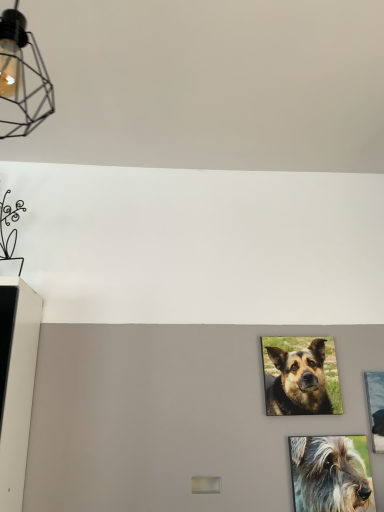
Question: Does brown fur dog at center, which is counted as the 1th dog, starting from the back, have a greater height compared to metallic silver picture frame at right?

Choices:
 (A) yes
 (B) no

Answer: (B)

Question: Is brown fur dog at center, which is the second dog from front to back, not within metallic silver picture frame at right?

Choices:
 (A) yes
 (B) no

Answer: (A)

Question: Is brown fur dog at center, the 2th dog when ordered from bottom to top, turned away from metallic silver picture frame at right?

Choices:
 (A) no
 (B) yes

Answer: (A)

Question: Considering the relative sizes of brown fur dog at center, which is the second dog from front to back, and metallic silver picture frame at right in the image provided, is brown fur dog at center, which is the second dog from front to back, smaller than metallic silver picture frame at right?

Choices:
 (A) no
 (B) yes

Answer: (B)

Question: Is brown fur dog at center, the 2th dog when ordered from bottom to top, bigger than metallic silver picture frame at right?

Choices:
 (A) no
 (B) yes

Answer: (A)

Question: From the image's perspective, is matte black wireframe light fixture at upper left positioned above or below brown fur dog at center, which is counted as the 1th dog, starting from the back?

Choices:
 (A) below
 (B) above

Answer: (B)

Question: Considering the positions of matte black wireframe light fixture at upper left and brown fur dog at center, which is counted as the 1th dog, starting from the back, in the image, is matte black wireframe light fixture at upper left wider or thinner than brown fur dog at center, which is counted as the 1th dog, starting from the back,?

Choices:
 (A) wide
 (B) thin

Answer: (A)

Question: Choose the correct answer: Is matte black wireframe light fixture at upper left inside brown fur dog at center, which is counted as the 1th dog, starting from the top, or outside it?

Choices:
 (A) inside
 (B) outside

Answer: (B)

Question: From a real-world perspective, is matte black wireframe light fixture at upper left physically located above or below brown fur dog at center, which is the second dog from front to back?

Choices:
 (A) above
 (B) below

Answer: (A)

Question: Based on their positions, is matte black wireframe light fixture at upper left located to the left or right of metallic silver picture frame at right?

Choices:
 (A) right
 (B) left

Answer: (B)

Question: From the image's perspective, is matte black wireframe light fixture at upper left above or below metallic silver picture frame at right?

Choices:
 (A) above
 (B) below

Answer: (A)

Question: Does point (13, 119) appear closer or farther from the camera than point (379, 378)?

Choices:
 (A) farther
 (B) closer

Answer: (B)

Question: Would you say matte black wireframe light fixture at upper left is inside or outside metallic silver picture frame at right?

Choices:
 (A) inside
 (B) outside

Answer: (B)

Question: Does point (370, 386) appear closer or farther from the camera than point (304, 489)?

Choices:
 (A) farther
 (B) closer

Answer: (A)

Question: Relative to shaggy gray dog at lower right, which is the 1th dog in front-to-back order, is metallic silver picture frame at right in front or behind?

Choices:
 (A) front
 (B) behind

Answer: (B)